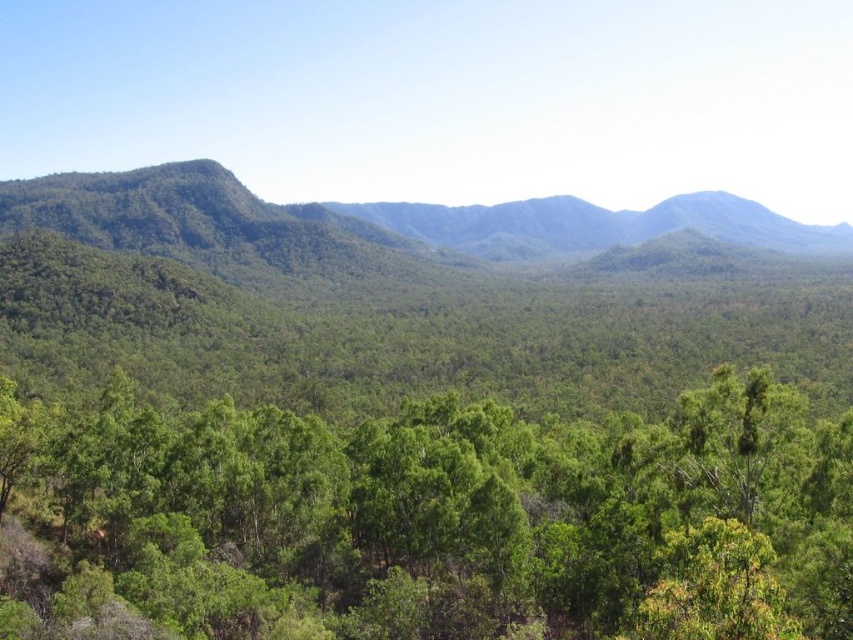
Question: Is the position of green leafy tree at center more distant than that of green leafy forest at left?

Choices:
 (A) no
 (B) yes

Answer: (A)

Question: Which point is closer to the camera taking this photo?

Choices:
 (A) (30, 269)
 (B) (96, 486)

Answer: (B)

Question: In this image, where is green leafy tree at center located relative to green leafy forest at left?

Choices:
 (A) right
 (B) left

Answer: (A)

Question: Can you confirm if green leafy tree at center is wider than green leafy forest at left?

Choices:
 (A) yes
 (B) no

Answer: (B)

Question: Which point is closer to the camera?

Choices:
 (A) (776, 496)
 (B) (374, 212)

Answer: (A)